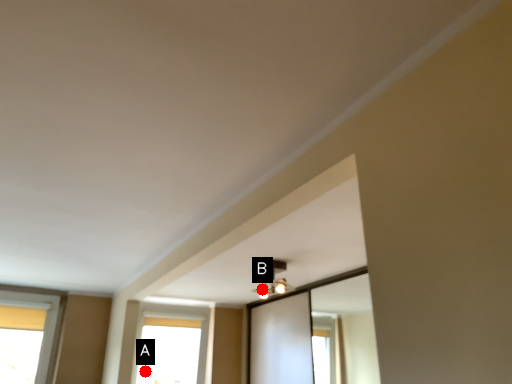
Question: Two points are circled on the image, labeled by A and B beside each circle. Which of the following is the closest to the observer?

Choices:
 (A) A is closer
 (B) B is closer

Answer: (B)